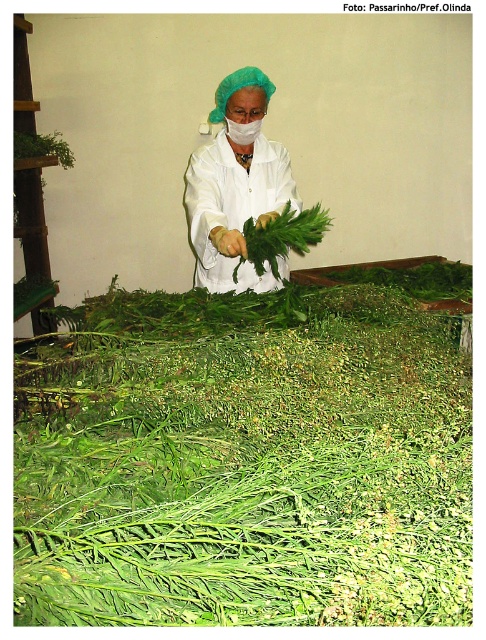
You are a quality control inspector in a herb processing facility. You need to check the green leafy grass at center for freshness. Where exactly should you look on the table to find it?

The green leafy grass at center is located at point (245, 465), so you should look there to check its freshness.

You are a quality inspector in a herb processing facility. You need to check the freshness of the green leafy grass at center before it is packaged. Where should you look relative to the white matte lab coat at center?

The green leafy grass at center is located to the left of the white matte lab coat at center, so you should look to the left side of the lab coat to inspect the grass.